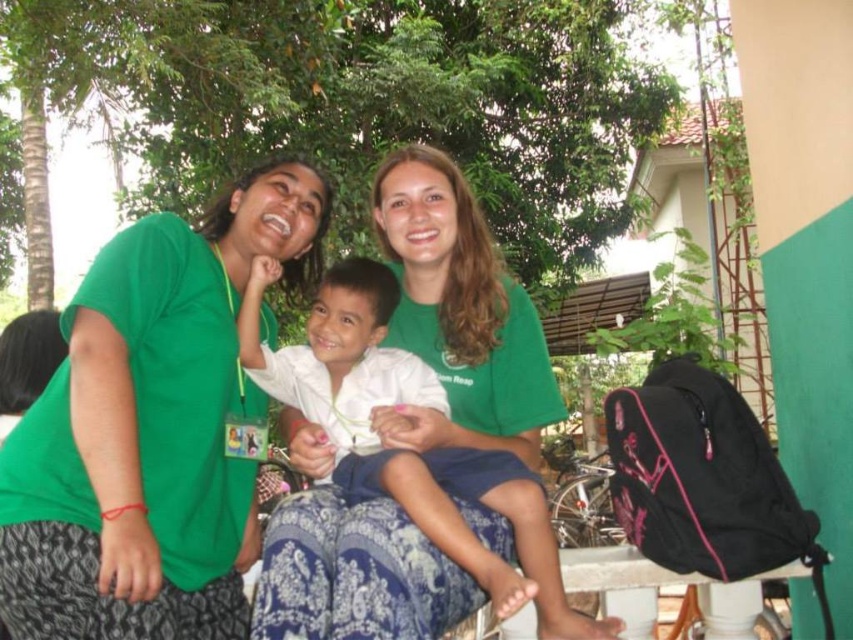
You are standing in the tropical garden scene. You see a point marked at coordinate (148, 428). What object is located at that point?

The point at coordinate (148, 428) marks the green fabric shirt at center.

Based on the coordinates provided, which object is located at point (x=148, y=428) in the image?

The point at (x=148, y=428) corresponds to the green fabric shirt at center.

You are a photographer setting up a tripod to take a group photo of the two adults in green shirts and the child. The tripod requires at least 30 inches of space between the two green shirts to fit everyone. Will the current distance between the green fabric shirt at center and the green cotton shirt at center allow the tripod to be set up properly?

The green fabric shirt at center is 30.18 inches from the green cotton shirt at center. Since the tripod requires at least 30 inches of space, the current distance of 30.18 inches is sufficient for the tripod to be set up properly.